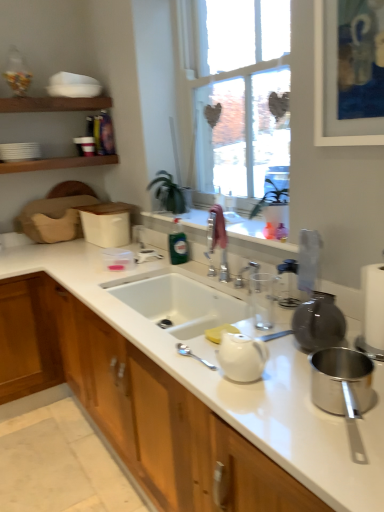
Question: From the image's perspective, is green glass bottle at center located above or below clear plastic bag at upper right, positioned as the second appliance in bottom-to-top order?

Choices:
 (A) above
 (B) below

Answer: (A)

Question: Is green glass bottle at center inside or outside of clear plastic bag at upper right, positioned as the second appliance in bottom-to-top order?

Choices:
 (A) inside
 (B) outside

Answer: (B)

Question: Estimate the real-world distances between objects in this image. Which object is farther from the clear plastic bag at upper right, which is counted as the first appliance, starting from the back?

Choices:
 (A) polished stainless steel pot at lower right, the second appliance viewed from the top
 (B) white ceramic sink at center
 (C) white glossy teapot at center
 (D) white glossy cabinet at center
 (E) green glass bottle at center

Answer: (E)

Question: Estimate the real-world distances between objects in this image. Which object is farther from the polished stainless steel pot at lower right, positioned as the 1th appliance in bottom-to-top order?

Choices:
 (A) white ceramic sink at center
 (B) green glass bottle at center
 (C) clear plastic bag at upper right, which is counted as the first appliance, starting from the back
 (D) white glossy teapot at center
 (E) white glossy cabinet at center

Answer: (B)